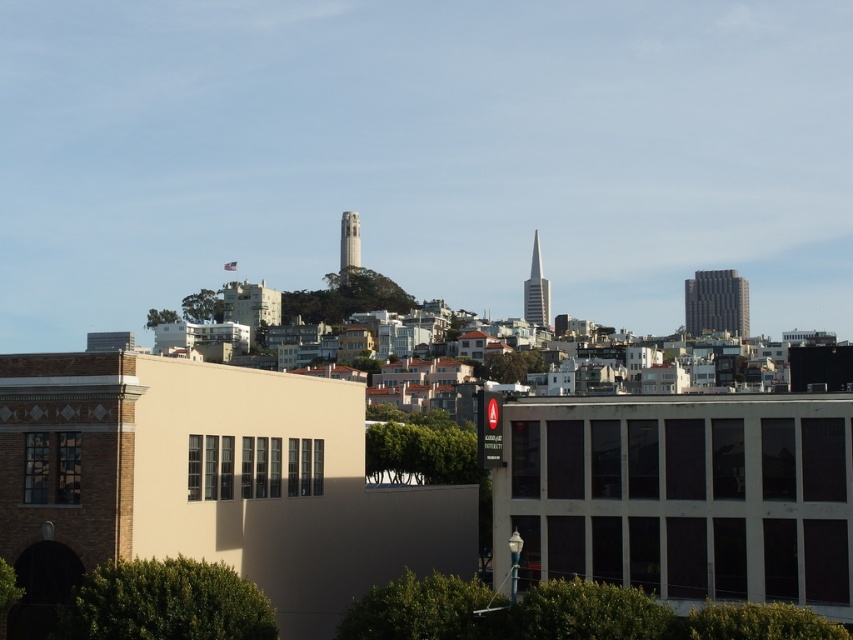
Question: Based on their relative distances, which object is nearer to the dark gray textured building at right?

Choices:
 (A) smooth concrete tower at center
 (B) shiny glass skyscraper at center

Answer: (B)

Question: Which point is farther to the camera?

Choices:
 (A) dark gray textured building at right
 (B) smooth concrete tower at center

Answer: (A)

Question: Does dark gray textured building at right have a greater width compared to shiny glass skyscraper at center?

Choices:
 (A) no
 (B) yes

Answer: (B)

Question: Is dark gray textured building at right bigger than smooth concrete tower at center?

Choices:
 (A) yes
 (B) no

Answer: (A)

Question: Does shiny glass skyscraper at center have a greater width compared to smooth concrete tower at center?

Choices:
 (A) yes
 (B) no

Answer: (B)

Question: Which of these objects is positioned closest to the shiny glass skyscraper at center?

Choices:
 (A) smooth concrete tower at center
 (B) dark gray textured building at right

Answer: (B)